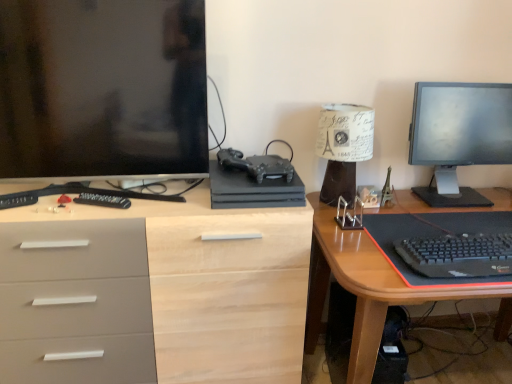
Question: From the image's perspective, is matte black monitor at left above black plastic remote control at left, placed as the second remote control when sorted from left to right?

Choices:
 (A) yes
 (B) no

Answer: (A)

Question: Is matte black monitor at left at the left side of black plastic remote control at left, placed as the second remote control when sorted from left to right?

Choices:
 (A) yes
 (B) no

Answer: (A)

Question: Considering the relative positions of matte black monitor at left and black plastic remote control at left, placed as the second remote control when sorted from left to right, in the image provided, is matte black monitor at left in front of black plastic remote control at left, placed as the second remote control when sorted from left to right,?

Choices:
 (A) no
 (B) yes

Answer: (B)

Question: Is matte black monitor at left further to camera compared to black plastic remote control at left, placed as the second remote control when sorted from left to right?

Choices:
 (A) no
 (B) yes

Answer: (A)

Question: Is matte black monitor at left next to black plastic remote control at left, which is counted as the 1th remote control, starting from the right, and touching it?

Choices:
 (A) no
 (B) yes

Answer: (A)

Question: Would you say matte black monitor at left is outside black plastic remote control at left, which is counted as the 1th remote control, starting from the right?

Choices:
 (A) yes
 (B) no

Answer: (A)

Question: Are wooden desk at right, which ranks as the 1th desk in right-to-left order, and matte black monitor at upper right making contact?

Choices:
 (A) yes
 (B) no

Answer: (B)

Question: Is wooden desk at right, positioned as the 2th desk in left-to-right order, wider than matte black monitor at upper right?

Choices:
 (A) no
 (B) yes

Answer: (B)

Question: Considering the relative sizes of wooden desk at right, which ranks as the 1th desk in right-to-left order, and matte black monitor at upper right in the image provided, is wooden desk at right, which ranks as the 1th desk in right-to-left order, thinner than matte black monitor at upper right?

Choices:
 (A) yes
 (B) no

Answer: (B)

Question: From a real-world perspective, is wooden desk at right, positioned as the 2th desk in left-to-right order, on top of matte black monitor at upper right?

Choices:
 (A) yes
 (B) no

Answer: (B)

Question: Does wooden desk at right, positioned as the 2th desk in left-to-right order, have a lesser height compared to matte black monitor at upper right?

Choices:
 (A) no
 (B) yes

Answer: (A)

Question: Is wooden desk at right, positioned as the 2th desk in left-to-right order, at the right side of matte black monitor at upper right?

Choices:
 (A) no
 (B) yes

Answer: (A)

Question: Considering the relative positions of white paper lampshade at upper right and matte black monitor at left in the image provided, is white paper lampshade at upper right to the right of matte black monitor at left from the viewer's perspective?

Choices:
 (A) no
 (B) yes

Answer: (B)